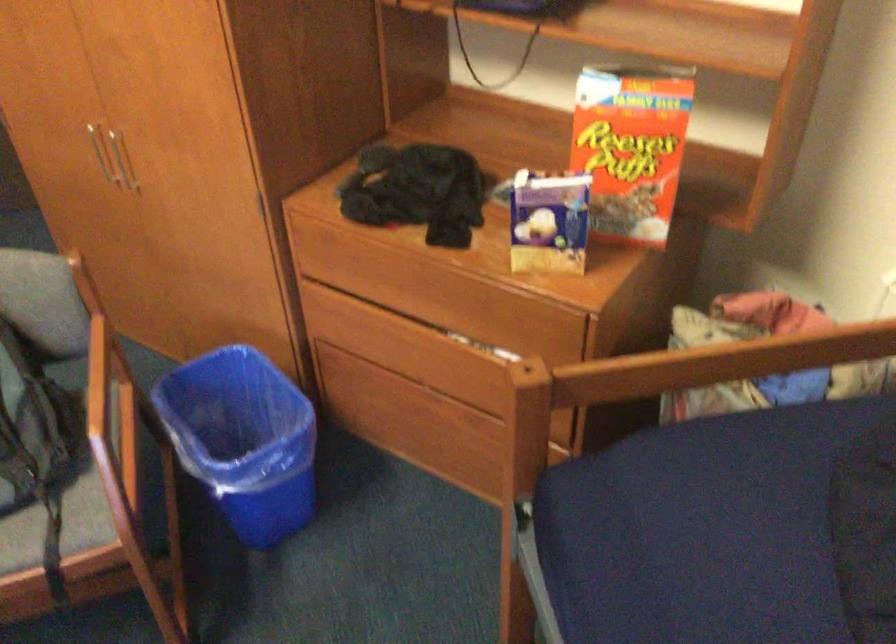
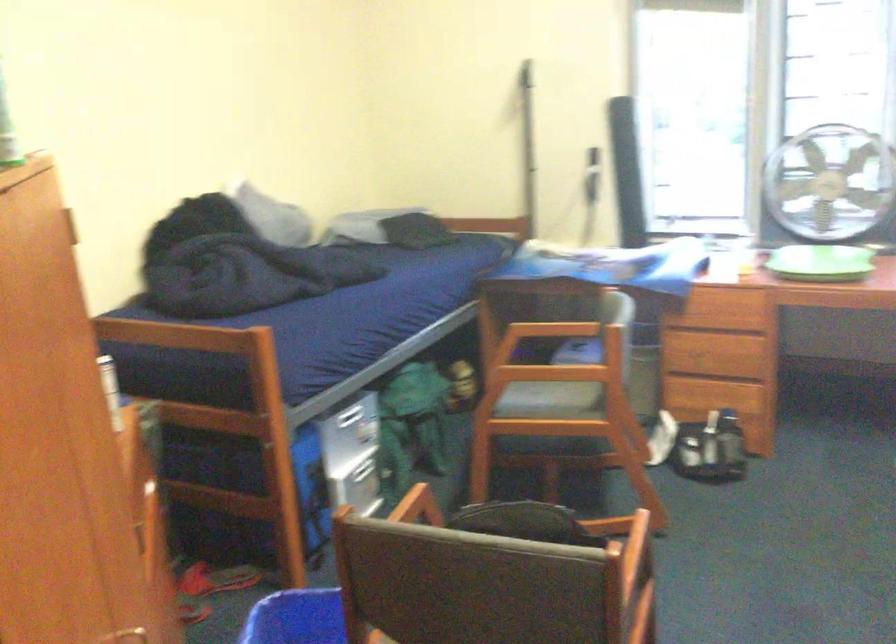
Find the pixel in the second image that matches [184,232] in the first image.

(141, 630)